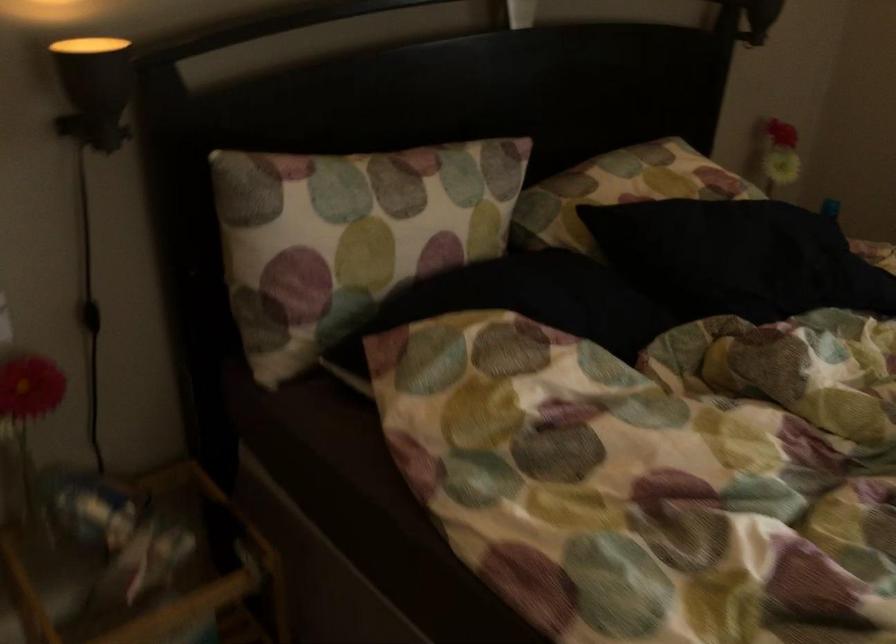
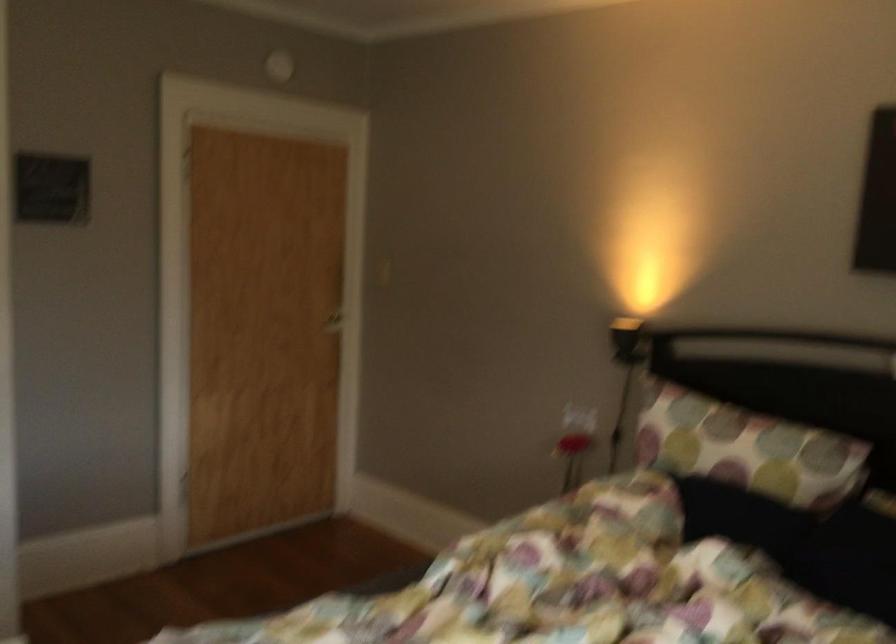
The point at (437, 210) is marked in the first image. Where is the corresponding point in the second image?

(746, 449)